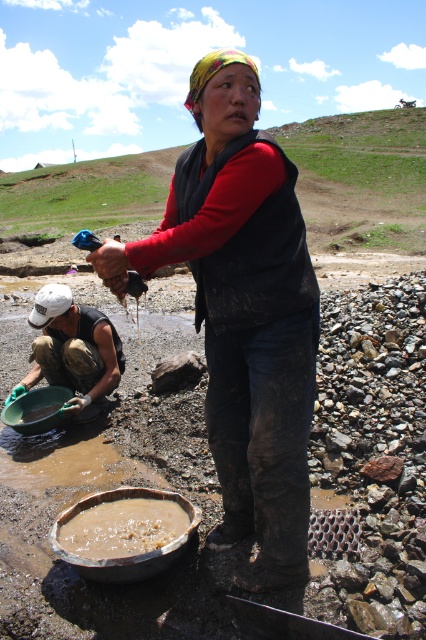
You are a construction worker who needs to choose a container to carry a large amount of mud. You have the white matte helmet at lower left and the brown clay pot at lower center available. Which one can hold more mud?

The white matte helmet at lower left has a larger size compared to the brown clay pot at lower center, so it can hold more mud.

You are planning to place a small flag between the dark blue jeans at center and the white matte helmet at lower left. Based on their positions, where should the flag be placed?

The flag should be placed below the dark blue jeans at center since it is above the white matte helmet at lower left.

You are a delivery person who needs to place a package between the dark blue jeans at center and the brown clay pot at lower center. The package is 25 inches long. Can you fit it between them?

The distance between the dark blue jeans at center and the brown clay pot at lower center is 25.49 inches. Since the package is 25 inches long, it can fit between them as there is enough space.